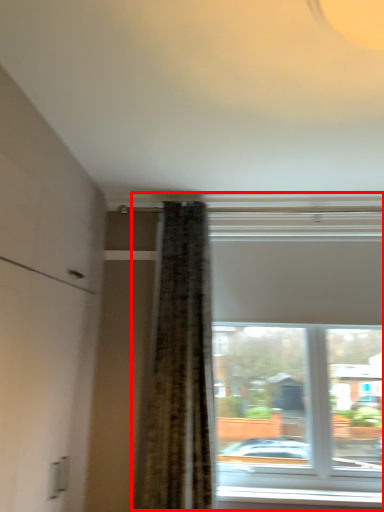
Question: Considering the relative positions of window (annotated by the red box) and window sill in the image provided, where is window (annotated by the red box) located with respect to the staircase?

Choices:
 (A) right
 (B) left

Answer: (A)